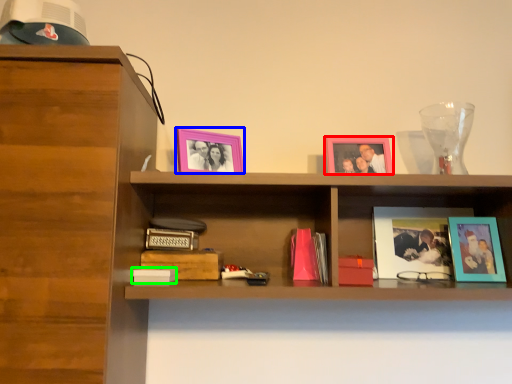
Question: Based on their relative distances, which object is nearer to picture frame (highlighted by a red box)? Choose from picture frame (highlighted by a blue box) and paperback book (highlighted by a green box).

Choices:
 (A) picture frame
 (B) paperback book

Answer: (A)